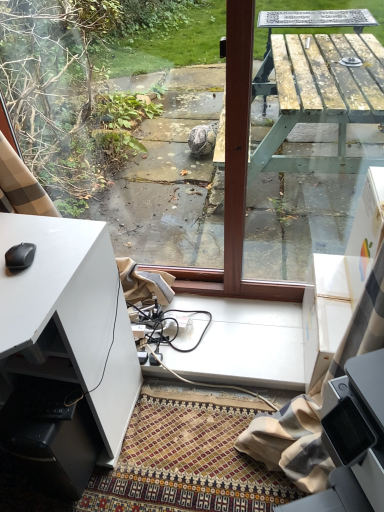
Question: Would you say black matte mouse at lower left is to the left or to the right of white matte desk at lower left in the picture?

Choices:
 (A) left
 (B) right

Answer: (B)

Question: From a real-world perspective, is black matte mouse at lower left above or below white matte desk at lower left?

Choices:
 (A) above
 (B) below

Answer: (A)

Question: Estimate the real-world distances between objects in this image. Which object is closer to the black matte mouse at lower left?

Choices:
 (A) white matte desk at lower left
 (B) wooden picnic table at center

Answer: (A)

Question: Which object is positioned closest to the wooden picnic table at center?

Choices:
 (A) white matte desk at lower left
 (B) black matte mouse at lower left

Answer: (A)